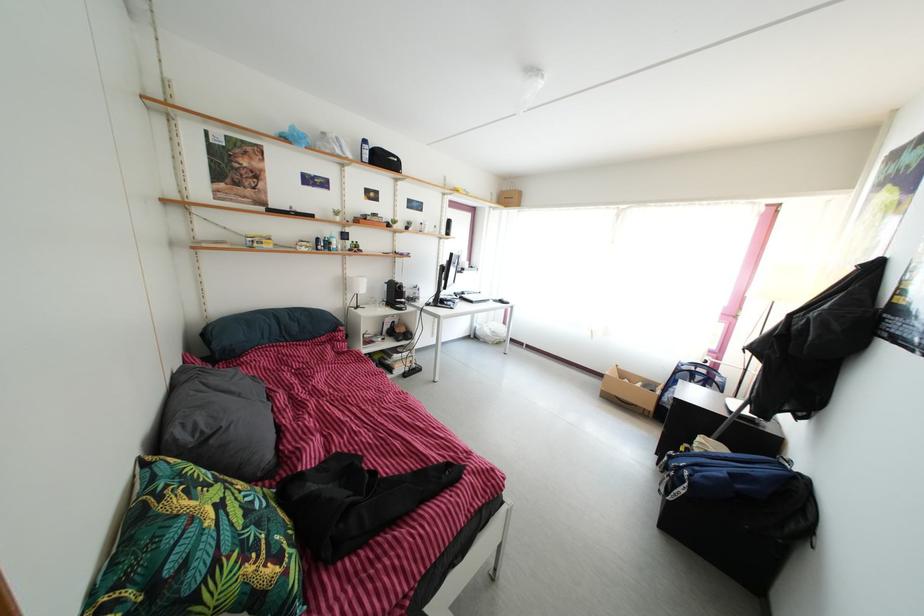
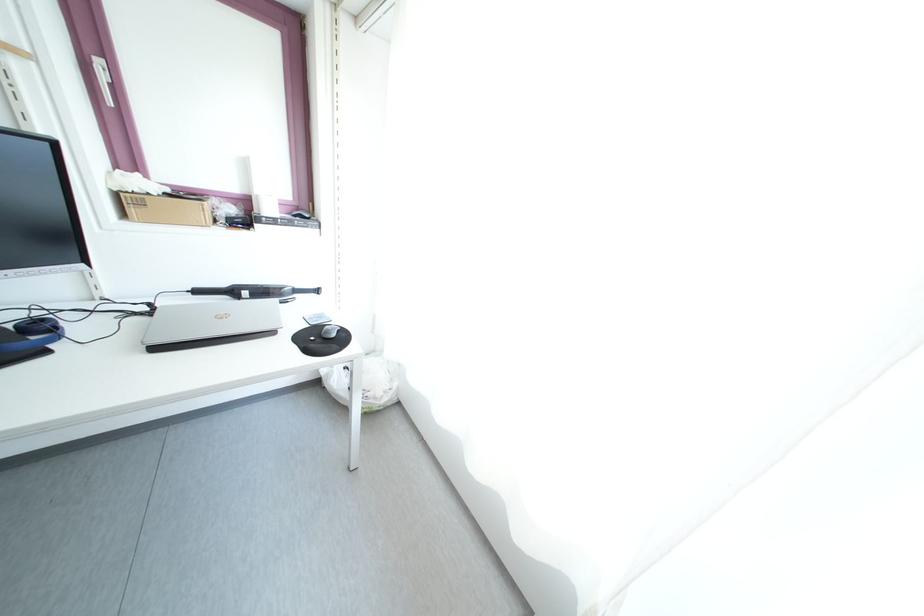
What movement of the cameraman would produce the second image?

The cameraman moved toward right, forward.